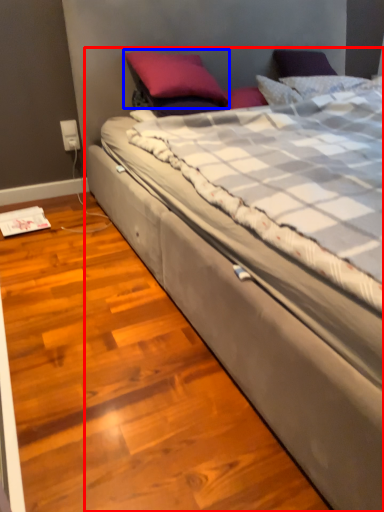
Question: Which object appears farthest to the camera in this image, bed (highlighted by a red box) or pillow (highlighted by a blue box)?

Choices:
 (A) bed
 (B) pillow

Answer: (B)